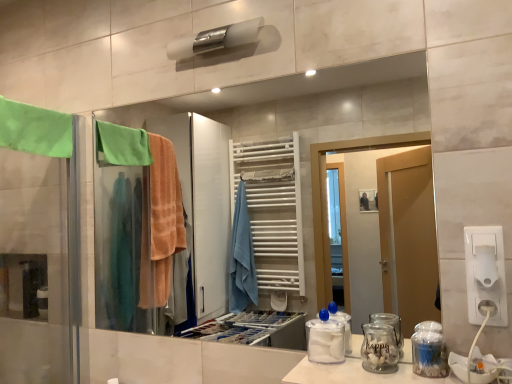
This screenshot has height=384, width=512. What do you see at coordinates (35, 129) in the screenshot?
I see `green fabric towel at left` at bounding box center [35, 129].

What is the approximate width of green fabric towel at left?

2.48 inches.

Describe the element at coordinates (309, 115) in the screenshot. I see `matte glass mirror at center` at that location.

In order to click on transparent glass jar at lower right in this screenshot , I will do `click(359, 370)`.

From the image's perspective, is clear glass jar at lower right, which is the 2th glass jar in right-to-left order, positioned above or below white plastic toilet paper at right?

clear glass jar at lower right, which is the 2th glass jar in right-to-left order, is below white plastic toilet paper at right.

Who is bigger, clear glass jar at lower right, which is the 2th glass jar in right-to-left order, or white plastic toilet paper at right?

clear glass jar at lower right, which is the 2th glass jar in right-to-left order, is bigger.

Between point (394, 340) and point (490, 276), which one is positioned in front?

The point (490, 276) is closer to the camera.

From the image's perspective, would you say white glossy sink at lower right is positioned over white plastic socket at lower right?

No.

Identify the location of sink lying on the left of white plastic socket at lower right. The image size is (512, 384). (488, 368).

Can you tell me how much white glossy sink at lower right and white plastic socket at lower right differ in facing direction?

The angular difference between white glossy sink at lower right and white plastic socket at lower right is 4.22 degrees.

Considering the relative sizes of white glossy sink at lower right and white plastic socket at lower right in the image provided, is white glossy sink at lower right wider than white plastic socket at lower right?

Yes.

Are white plastic socket at lower right and white matte towel bar at upper center far apart?

No, there isn't a large distance between white plastic socket at lower right and white matte towel bar at upper center.

Locate an element on the screen. Image resolution: width=512 pixels, height=384 pixels. towel bar to the left of white plastic socket at lower right is located at coordinates (215, 39).

How different are the orientations of white plastic socket at lower right and white matte towel bar at upper center in degrees?

They differ by 0.268 degrees in their facing directions.

Is white plastic socket at lower right positioned with its back to white matte towel bar at upper center?

No.

Does white plastic socket at lower right lie in front of transparent plastic container at center?

That is True.

Looking at this image, is white plastic socket at lower right shorter than transparent plastic container at center?

No, white plastic socket at lower right is not shorter than transparent plastic container at center.

Locate an element on the screen. Image resolution: width=512 pixels, height=384 pixels. electric outlet positioned vertically above the transparent plastic container at center (from a real-world perspective) is located at coordinates (485, 274).

Can you confirm if white plastic toilet paper at right is wider than transparent glass jar at lower right?

No, white plastic toilet paper at right is not wider than transparent glass jar at lower right.

Between white plastic toilet paper at right and transparent glass jar at lower right, which one is positioned behind?

white plastic toilet paper at right.

From a real-world perspective, who is located lower, white plastic toilet paper at right or transparent glass jar at lower right?

From a 3D spatial view, transparent glass jar at lower right is below.

Considering the sizes of white plastic toilet paper at right and transparent glass jar at lower right in the image, is white plastic toilet paper at right taller or shorter than transparent glass jar at lower right?

Considering their sizes, white plastic toilet paper at right has more height than transparent glass jar at lower right.

Between white matte towel bar at upper center and clear glass jar at lower right, placed as the 1th glass jar when sorted from left to right, which one appears on the right side from the viewer's perspective?

From the viewer's perspective, clear glass jar at lower right, placed as the 1th glass jar when sorted from left to right, appears more on the right side.

Considering the relative sizes of white matte towel bar at upper center and clear glass jar at lower right, placed as the 1th glass jar when sorted from left to right, in the image provided, is white matte towel bar at upper center wider than clear glass jar at lower right, placed as the 1th glass jar when sorted from left to right,?

Indeed, white matte towel bar at upper center has a greater width compared to clear glass jar at lower right, placed as the 1th glass jar when sorted from left to right.

Can you confirm if white matte towel bar at upper center is bigger than clear glass jar at lower right, which is the 2th glass jar in right-to-left order?

Yes, white matte towel bar at upper center is bigger than clear glass jar at lower right, which is the 2th glass jar in right-to-left order.

Does white glossy sink at lower right appear on the left side of white matte towel bar at upper center?

No.

In terms of width, does white glossy sink at lower right look wider or thinner when compared to white matte towel bar at upper center?

Clearly, white glossy sink at lower right has less width compared to white matte towel bar at upper center.

I want to click on towel bar that appears behind the white glossy sink at lower right, so click(215, 39).

Is white glossy sink at lower right outside of white matte towel bar at upper center?

Yes, white glossy sink at lower right is located beyond the bounds of white matte towel bar at upper center.

This screenshot has width=512, height=384. I want to click on the 2nd glass jar behind the white plastic toilet paper at right, so click(382, 343).

This screenshot has height=384, width=512. I want to click on sink in front of the white plastic socket at lower right, so click(488, 368).

Considering their positions, is transparent plastic container at center positioned further to transparent glass jar at lower right than white plastic socket at lower right?

white plastic socket at lower right.

Which object lies further to the anchor point transparent glass jar at lower right, transparent plastic container at center or white glossy sink at lower right?

white glossy sink at lower right lies further to transparent glass jar at lower right than the other object.

When comparing their distances from clear glass jar at lower right, which is the 2th glass jar in right-to-left order, does clear plastic jar at lower right, positioned as the first glass jar in right-to-left order, or white plastic socket at lower right seem closer?

clear plastic jar at lower right, positioned as the first glass jar in right-to-left order, is positioned closer to the anchor clear glass jar at lower right, which is the 2th glass jar in right-to-left order.

Which object lies nearer to the anchor point matte glass mirror at center, white matte towel bar at upper center or clear plastic jar at lower right, positioned as the first glass jar in right-to-left order?

white matte towel bar at upper center is closer to matte glass mirror at center.

From the image, which object appears to be nearer to transparent glass jar at lower right, white glossy sink at lower right or white plastic socket at lower right?

Among the two, white glossy sink at lower right is located nearer to transparent glass jar at lower right.

Consider the image. When comparing their distances from transparent plastic container at center, does white glossy sink at lower right or transparent glass jar at lower right seem further?

white glossy sink at lower right is further to transparent plastic container at center.

When comparing their distances from green fabric towel at left, does clear plastic jar at lower right, positioned as the first glass jar in right-to-left order, or white plastic toilet paper at right seem further?

The object further to green fabric towel at left is white plastic toilet paper at right.

Looking at the image, which one is located closer to matte glass mirror at center, white plastic socket at lower right or green fabric towel at left?

green fabric towel at left is closer to matte glass mirror at center.

What are the coordinates of `glass jar located between matte glass mirror at center and clear plastic jar at lower right, the second glass jar positioned from the left, in the left-right direction` in the screenshot? It's located at (382, 343).

This screenshot has height=384, width=512. What are the coordinates of `towel bar situated between green fabric towel at left and white plastic socket at lower right from left to right` in the screenshot? It's located at (215, 39).

Locate an element on the screen. This screenshot has height=384, width=512. toilet paper between green fabric towel at left and white plastic socket at lower right in the horizontal direction is located at coordinates (485, 265).

The height and width of the screenshot is (384, 512). In order to click on bottle situated between green fabric towel at left and white plastic toilet paper at right from left to right in this screenshot , I will do `click(325, 339)`.